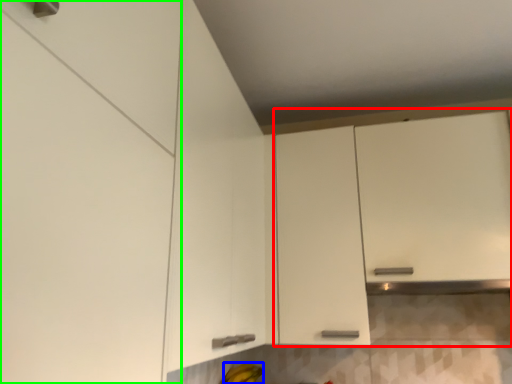
Question: Which object is positioned farthest from cabinetry (highlighted by a red box)? Select from banana (highlighted by a blue box) and cabinetry (highlighted by a green box).

Choices:
 (A) banana
 (B) cabinetry

Answer: (B)